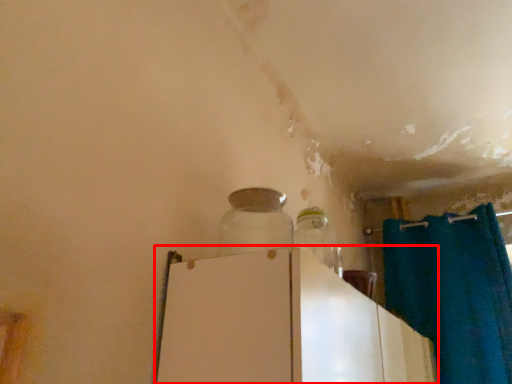
Question: From the image, what is the correct spatial relationship of appliance (annotated by the red box) in relation to bottle?

Choices:
 (A) right
 (B) left

Answer: (A)